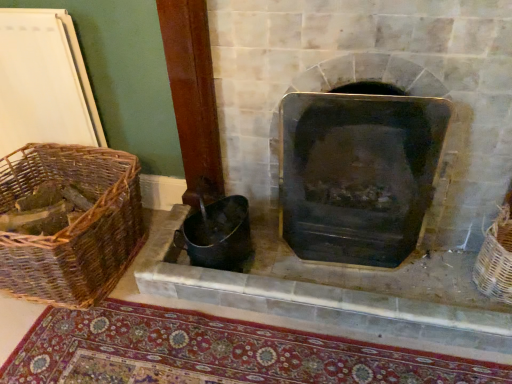
How much space does woven brown basket at left, placed as the first basket when sorted from left to right, occupy vertically?

It is 14.47 inches.

Locate an element on the screen. The image size is (512, 384). black metal fireplace at center is located at coordinates (435, 183).

Describe the element at coordinates (435, 183) in the screenshot. I see `black metal fireplace at center` at that location.

Describe the element at coordinates (496, 259) in the screenshot. I see `woven wicker basket at right, the 2th basket positioned from the left` at that location.

What do you see at coordinates (358, 174) in the screenshot? I see `black matte wood burning stove at center` at bounding box center [358, 174].

The width and height of the screenshot is (512, 384). In order to click on woven brown basket at left, placed as the first basket when sorted from left to right in this screenshot , I will do `click(72, 225)`.

How distant is carpeted mat at lower center from black matte wood burning stove at center?

carpeted mat at lower center and black matte wood burning stove at center are 20.52 inches apart.

Is carpeted mat at lower center positioned far away from black matte wood burning stove at center?

That's not correct — carpeted mat at lower center is a little close to black matte wood burning stove at center.

Can you tell me how much carpeted mat at lower center and black matte wood burning stove at center differ in facing direction?

0.464 degrees separate the facing orientations of carpeted mat at lower center and black matte wood burning stove at center.

Could you tell me if carpeted mat at lower center is facing black matte wood burning stove at center?

No, carpeted mat at lower center is not oriented towards black matte wood burning stove at center.

Between point (232, 61) and point (289, 235), which one is positioned behind?

The point (289, 235) is behind.

In terms of height, does black metal fireplace at center look taller or shorter compared to black matte wood burning stove at center?

black metal fireplace at center is taller than black matte wood burning stove at center.

Consider the image. Are black metal fireplace at center and black matte wood burning stove at center located far from each other?

A: No, there isn't a large distance between black metal fireplace at center and black matte wood burning stove at center.

From a real-world perspective, which object stands above the other?

black matte wood burning stove at center, from a real-world perspective.

Does black matte wood burning stove at center have a smaller size compared to carpeted mat at lower center?

Incorrect, black matte wood burning stove at center is not smaller in size than carpeted mat at lower center.

Relative to carpeted mat at lower center, is black matte wood burning stove at center in front or behind?

Visually, black matte wood burning stove at center is located behind carpeted mat at lower center.

How many degrees apart are the facing directions of black matte wood burning stove at center and carpeted mat at lower center?

The angle between the facing direction of black matte wood burning stove at center and the facing direction of carpeted mat at lower center is 0.464 degrees.

Choose the correct answer: Is black matte wood burning stove at center inside woven wicker basket at right, arranged as the 1th basket when viewed from the right, or outside it?

black matte wood burning stove at center lies outside woven wicker basket at right, arranged as the 1th basket when viewed from the right.

Is black matte wood burning stove at center thinner than woven wicker basket at right, the 2th basket positioned from the left?

In fact, black matte wood burning stove at center might be wider than woven wicker basket at right, the 2th basket positioned from the left.

Considering the points (322, 172) and (483, 275), which point is in front, point (322, 172) or point (483, 275)?

The point (322, 172) is closer to the camera.

The image size is (512, 384). In order to click on wood burning stove on the left of woven wicker basket at right, arranged as the 1th basket when viewed from the right in this screenshot , I will do `click(358, 174)`.

Would you say black metal fireplace at center is part of woven wicker basket at right, the 2th basket positioned from the left,'s contents?

No, black metal fireplace at center is not a part of woven wicker basket at right, the 2th basket positioned from the left.

Considering the positions of objects woven wicker basket at right, arranged as the 1th basket when viewed from the right, and black metal fireplace at center in the image provided, who is behind, woven wicker basket at right, arranged as the 1th basket when viewed from the right, or black metal fireplace at center?

woven wicker basket at right, arranged as the 1th basket when viewed from the right, is further from the camera.

Is woven wicker basket at right, arranged as the 1th basket when viewed from the right, next to black metal fireplace at center and touching it?

There is a gap between woven wicker basket at right, arranged as the 1th basket when viewed from the right, and black metal fireplace at center.

Is woven wicker basket at right, arranged as the 1th basket when viewed from the right, smaller than black metal fireplace at center?

Correct, woven wicker basket at right, arranged as the 1th basket when viewed from the right, occupies less space than black metal fireplace at center.

Based on the photo, how many degrees apart are the facing directions of black matte wood burning stove at center and woven brown basket at left, the second basket positioned from the right?

The angular difference between black matte wood burning stove at center and woven brown basket at left, the second basket positioned from the right, is 3.67 degrees.

Considering the relative sizes of black matte wood burning stove at center and woven brown basket at left, the second basket positioned from the right, in the image provided, is black matte wood burning stove at center bigger than woven brown basket at left, the second basket positioned from the right,?

Yes.

Consider the image. Is black matte wood burning stove at center far away from woven brown basket at left, placed as the first basket when sorted from left to right?

black matte wood burning stove at center is actually quite close to woven brown basket at left, placed as the first basket when sorted from left to right.

From the image's perspective, which is below, black matte wood burning stove at center or woven brown basket at left, the second basket positioned from the right?

woven brown basket at left, the second basket positioned from the right, from the image's perspective.

The image size is (512, 384). I want to click on mat below the black metal fireplace at center (from the image's perspective), so click(217, 352).

Is black metal fireplace at center smaller than carpeted mat at lower center?

Incorrect, black metal fireplace at center is not smaller in size than carpeted mat at lower center.

Is black metal fireplace at center to the left or to the right of carpeted mat at lower center in the image?

Clearly, black metal fireplace at center is on the right of carpeted mat at lower center in the image.

From a real-world perspective, which object stands above the other?

black metal fireplace at center, from a real-world perspective.

The width and height of the screenshot is (512, 384). I want to click on mat on the left of black matte wood burning stove at center, so click(217, 352).

Image resolution: width=512 pixels, height=384 pixels. I want to click on wood burning stove lying behind the black metal fireplace at center, so click(x=358, y=174).

Considering their positions, is carpeted mat at lower center positioned further to woven wicker basket at right, the 2th basket positioned from the left, than black metal fireplace at center?

carpeted mat at lower center is further to woven wicker basket at right, the 2th basket positioned from the left.

Based on the photo, from the image, which object appears to be farther from woven brown basket at left, placed as the first basket when sorted from left to right, black metal fireplace at center or carpeted mat at lower center?

black metal fireplace at center is positioned further to the anchor woven brown basket at left, placed as the first basket when sorted from left to right.

Based on their spatial positions, is black matte wood burning stove at center or woven wicker basket at right, arranged as the 1th basket when viewed from the right, further from black metal fireplace at center?

The object further to black metal fireplace at center is woven wicker basket at right, arranged as the 1th basket when viewed from the right.

Based on their spatial positions, is woven brown basket at left, the second basket positioned from the right, or black metal fireplace at center closer to woven wicker basket at right, the 2th basket positioned from the left?

Among the two, black metal fireplace at center is located nearer to woven wicker basket at right, the 2th basket positioned from the left.

Based on their spatial positions, is woven brown basket at left, the second basket positioned from the right, or black matte wood burning stove at center closer to carpeted mat at lower center?

woven brown basket at left, the second basket positioned from the right, lies closer to carpeted mat at lower center than the other object.

Based on their spatial positions, is woven brown basket at left, the second basket positioned from the right, or black matte wood burning stove at center further from woven wicker basket at right, the 2th basket positioned from the left?

Among the two, woven brown basket at left, the second basket positioned from the right, is located further to woven wicker basket at right, the 2th basket positioned from the left.

Considering their positions, is woven wicker basket at right, the 2th basket positioned from the left, positioned further to black matte wood burning stove at center than black metal fireplace at center?

woven wicker basket at right, the 2th basket positioned from the left.

From the picture: Which object lies further to the anchor point woven wicker basket at right, arranged as the 1th basket when viewed from the right, black matte wood burning stove at center or carpeted mat at lower center?

carpeted mat at lower center lies further to woven wicker basket at right, arranged as the 1th basket when viewed from the right, than the other object.

Where is `wood burning stove between woven brown basket at left, the second basket positioned from the right, and woven wicker basket at right, the 2th basket positioned from the left, in the horizontal direction`? The width and height of the screenshot is (512, 384). wood burning stove between woven brown basket at left, the second basket positioned from the right, and woven wicker basket at right, the 2th basket positioned from the left, in the horizontal direction is located at coordinates (358, 174).

Identify the location of wood burning stove situated between black metal fireplace at center and woven wicker basket at right, arranged as the 1th basket when viewed from the right, from left to right. The height and width of the screenshot is (384, 512). (358, 174).

Where is `mat between woven brown basket at left, placed as the first basket when sorted from left to right, and woven wicker basket at right, the 2th basket positioned from the left, from left to right`? mat between woven brown basket at left, placed as the first basket when sorted from left to right, and woven wicker basket at right, the 2th basket positioned from the left, from left to right is located at coordinates (217, 352).

Find the location of a particular element. wood burning stove between carpeted mat at lower center and woven wicker basket at right, arranged as the 1th basket when viewed from the right, from left to right is located at coordinates (358, 174).